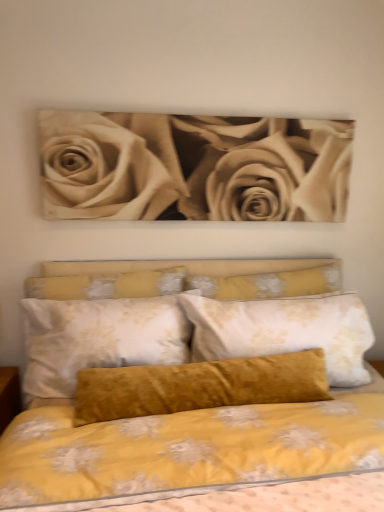
This screenshot has height=512, width=384. What do you see at coordinates (268, 283) in the screenshot?
I see `velvet yellow pillow at center` at bounding box center [268, 283].

Where is `velvet yellow pillow at center`? The height and width of the screenshot is (512, 384). velvet yellow pillow at center is located at coordinates (268, 283).

What do you see at coordinates (194, 166) in the screenshot? I see `sepia-toned roses at upper center` at bounding box center [194, 166].

Where is `velvet yellow pillow at center`? The image size is (384, 512). velvet yellow pillow at center is located at coordinates (268, 283).

How much distance is there between velvet yellow pillow at center and sepia-toned roses at upper center?

The distance of velvet yellow pillow at center from sepia-toned roses at upper center is 16.95 inches.

Find the location of a particular element. Image resolution: width=384 pixels, height=512 pixels. rose in front of the velvet yellow pillow at center is located at coordinates (194, 166).

Is velvet yellow pillow at center next to sepia-toned roses at upper center and touching it?

No, velvet yellow pillow at center is not touching sepia-toned roses at upper center.

Which of these two, velvet yellow pillow at center or sepia-toned roses at upper center, stands taller?

sepia-toned roses at upper center is taller.

Measure the distance from velvet mustard pillow at center to sepia-toned roses at upper center.

They are 38.15 inches apart.

Does velvet mustard pillow at center have a greater height compared to sepia-toned roses at upper center?

Correct, velvet mustard pillow at center is much taller as sepia-toned roses at upper center.

Consider the image. Which is more to the right, velvet mustard pillow at center or sepia-toned roses at upper center?

From the viewer's perspective, velvet mustard pillow at center appears more on the right side.

Find the location of a particular element. This screenshot has width=384, height=512. rose that is behind the velvet mustard pillow at center is located at coordinates (194, 166).

Looking at this image, is sepia-toned roses at upper center in front of velvet mustard pillow at center?

No, sepia-toned roses at upper center is behind velvet mustard pillow at center.

Does sepia-toned roses at upper center have a smaller size compared to velvet mustard pillow at center?

Yes.

Which of these two, sepia-toned roses at upper center or velvet mustard pillow at center, stands shorter?

sepia-toned roses at upper center.

The height and width of the screenshot is (512, 384). There is a velvet mustard pillow at center. What are the coordinates of `rose above it (from a real-world perspective)` in the screenshot? It's located at (194, 166).

Can you see sepia-toned roses at upper center touching velvet yellow pillow at center?

They are not placed beside each other.

Which object is positioned more to the left, sepia-toned roses at upper center or velvet yellow pillow at center?

From the viewer's perspective, sepia-toned roses at upper center appears more on the left side.

Can you tell me how much sepia-toned roses at upper center and velvet yellow pillow at center differ in facing direction?

The angular difference between sepia-toned roses at upper center and velvet yellow pillow at center is 3.03 degrees.

Consider the image. Could you tell me if sepia-toned roses at upper center is turned towards velvet yellow pillow at center?

No, sepia-toned roses at upper center is not oriented towards velvet yellow pillow at center.

Considering their positions, is velvet mustard pillow at center located in front of or behind velvet yellow pillow at center?

velvet mustard pillow at center is in front of velvet yellow pillow at center.

From the picture: Can you tell me how much velvet mustard pillow at center and velvet yellow pillow at center differ in facing direction?

They differ by 0.664 degrees in their facing directions.

In the scene shown: Does velvet mustard pillow at center turn towards velvet yellow pillow at center?

No, velvet mustard pillow at center does not turn towards velvet yellow pillow at center.

Is velvet yellow pillow at center inside velvet mustard pillow at center?

Definitely not — velvet yellow pillow at center is not inside velvet mustard pillow at center.

Is velvet yellow pillow at center in contact with velvet mustard pillow at center?

No, velvet yellow pillow at center is not in contact with velvet mustard pillow at center.

Does point (188, 285) come closer to viewer compared to point (74, 506)?

That is False.

Which object is closer to the camera taking this photo, velvet yellow pillow at center or velvet mustard pillow at center?

velvet mustard pillow at center is closer to the camera.

Based on the photo, is velvet yellow pillow at center shorter than velvet mustard pillow at center?

Correct, velvet yellow pillow at center is not as tall as velvet mustard pillow at center.

Where is `pillow located behind the sepia-toned roses at upper center`? This screenshot has height=512, width=384. pillow located behind the sepia-toned roses at upper center is located at coordinates (268, 283).

What are the coordinates of `rose above the velvet mustard pillow at center (from the image's perspective)` in the screenshot? It's located at (194, 166).

Looking at the image, which one is located closer to velvet yellow pillow at center, velvet mustard pillow at center or sepia-toned roses at upper center?

Answer: sepia-toned roses at upper center.

Based on their spatial positions, is sepia-toned roses at upper center or velvet yellow pillow at center closer to velvet mustard pillow at center?

The object closer to velvet mustard pillow at center is velvet yellow pillow at center.

Considering their positions, is velvet yellow pillow at center positioned closer to velvet mustard pillow at center than sepia-toned roses at upper center?

Based on the image, velvet yellow pillow at center appears to be nearer to velvet mustard pillow at center.

When comparing their distances from velvet yellow pillow at center, does sepia-toned roses at upper center or velvet mustard pillow at center seem closer?

sepia-toned roses at upper center is positioned closer to the anchor velvet yellow pillow at center.

Based on their spatial positions, is velvet yellow pillow at center or velvet mustard pillow at center further from sepia-toned roses at upper center?

The object further to sepia-toned roses at upper center is velvet mustard pillow at center.

Estimate the real-world distances between objects in this image. Which object is closer to sepia-toned roses at upper center, velvet mustard pillow at center or velvet yellow pillow at center?

The object closer to sepia-toned roses at upper center is velvet yellow pillow at center.

Find the location of `pillow between sepia-toned roses at upper center and velvet mustard pillow at center vertically`. pillow between sepia-toned roses at upper center and velvet mustard pillow at center vertically is located at coordinates (268, 283).